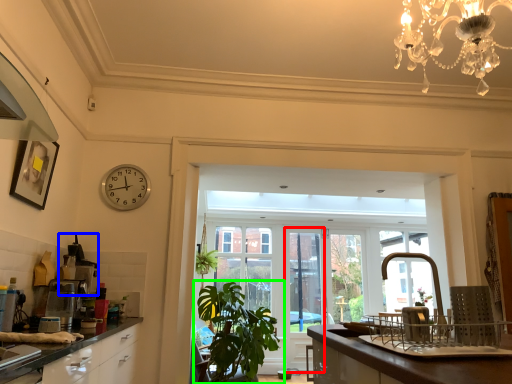
Question: Which object is the closest to the screen door (highlighted by a red box)? Choose among these: appliance (highlighted by a blue box) or houseplant (highlighted by a green box).

Choices:
 (A) appliance
 (B) houseplant

Answer: (B)